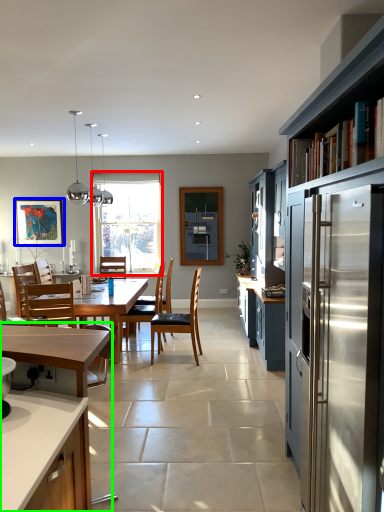
Question: Which object is the closest to the window (highlighted by a red box)? Choose among these: picture frame (highlighted by a blue box) or cabinetry (highlighted by a green box).

Choices:
 (A) picture frame
 (B) cabinetry

Answer: (A)